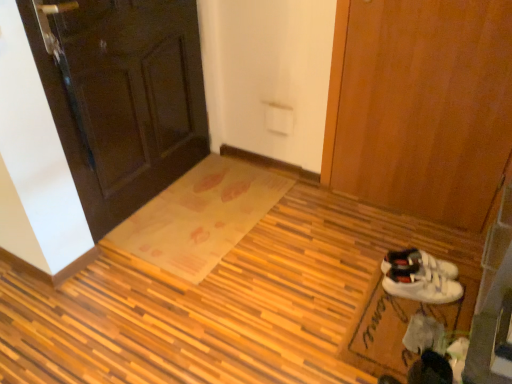
This screenshot has height=384, width=512. Identify the location of free spot to the left of white fabric doormat at lower right, arranged as the 2th doormat when viewed from the left. (287, 308).